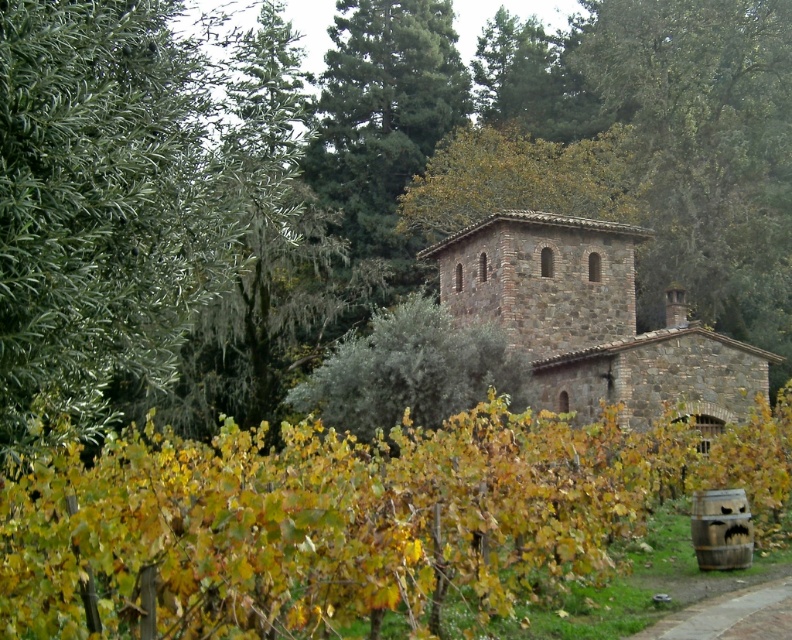
You are standing in front of the rustic stone building and want to take a photo that includes both the green leafy vineyard at center and the green textured pine tree at upper center. Which object should be placed on the left side of the photo to ensure both are in the frame?

The green textured pine tree at upper center should be placed on the left side of the photo because the green leafy vineyard at center is to the right of it.

You are a tourist standing in front of the rustic stone building. You want to take a photo of the brick paved path at lower right. However, you notice the green leafy vineyard at center is blocking your view. Can you determine if the vineyard is in front of or behind the path?

The green leafy vineyard at center is in front of the brick paved path at lower right, so it is blocking your view.